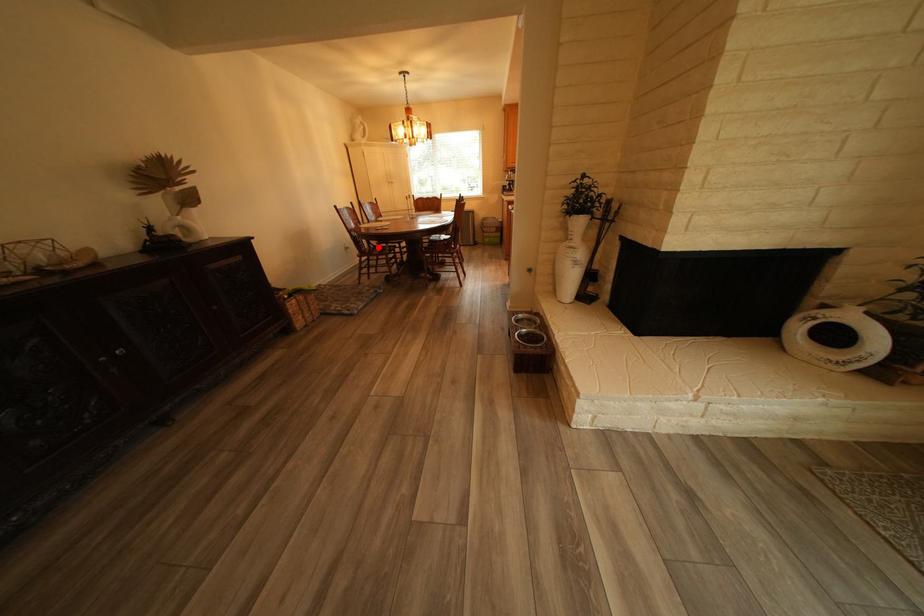
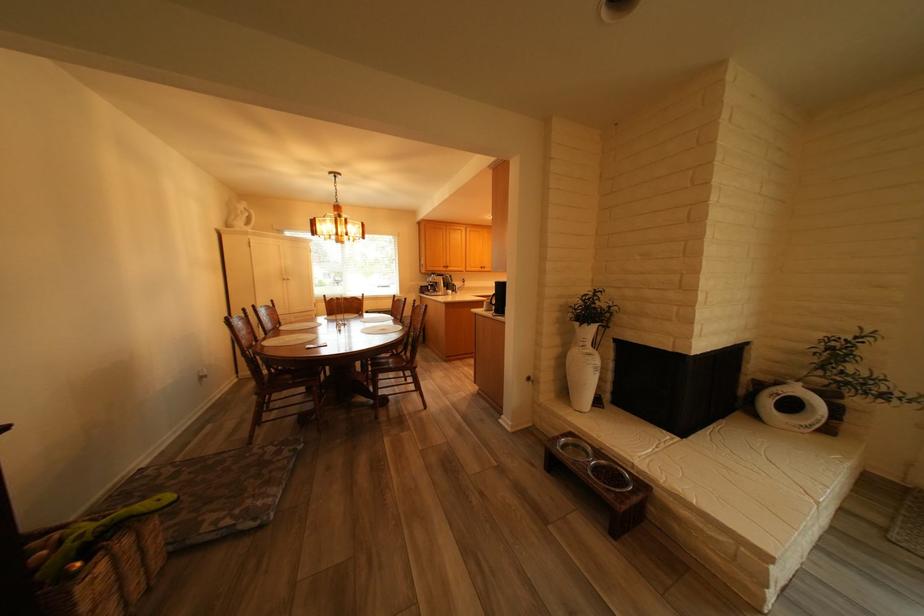
Question: A red point is marked in image1. In image2, is the corresponding 3D point closer to the camera or farther? Reply with the corresponding letter.

Choices:
 (A) The corresponding 3D point is closer.
 (B) The corresponding 3D point is farther.

Answer: (B)